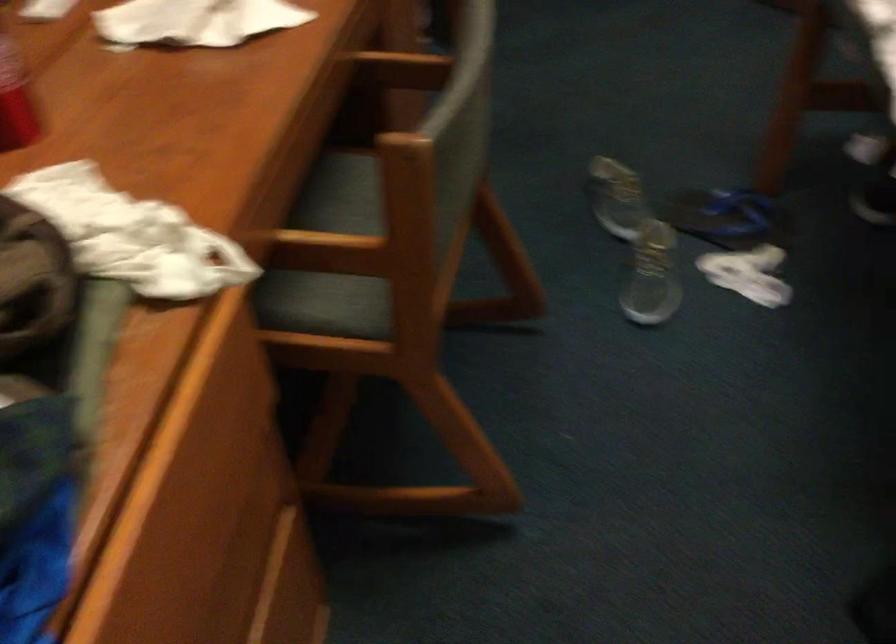
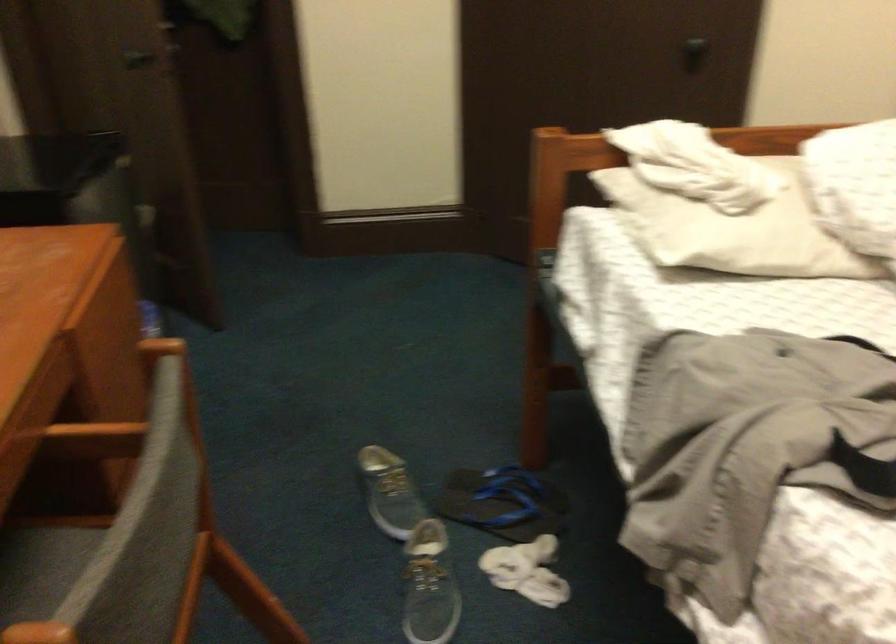
Question: Based on the continuous images, in which direction is the camera rotating? Reply with the corresponding letter.

Choices:
 (A) Left
 (B) Right
 (C) Up
 (D) Down

Answer: (B)